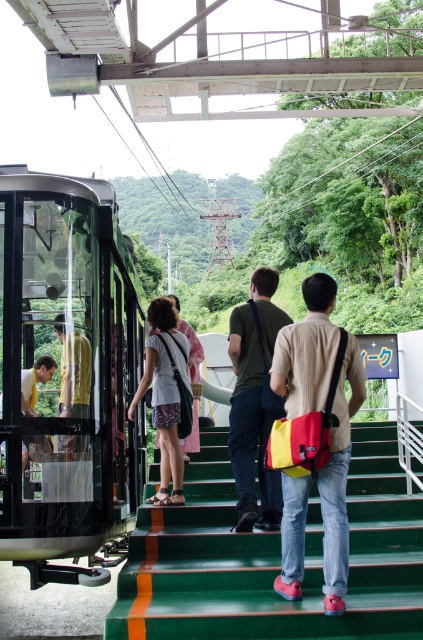
You are a photographer trying to capture the cable car station scene. You notice two points of interest marked as point (136, 481) and point (269, 355). Which point is closer to your camera position?

Point (136, 481) is further to the camera than point (269, 355), so the point closer to your camera is point (269, 355).

You are a passenger waiting to board the cable car and want to know which person is closer to you. The people you can see are the green fabric shirt at center and the matte black shirt at left. Which one is nearer?

The green fabric shirt at center is closer to you because it is positioned further to the viewer than the matte black shirt at left.